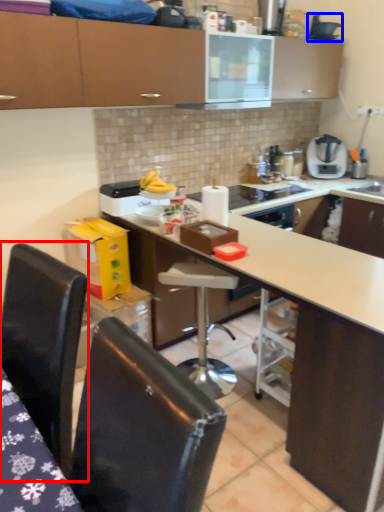
Question: Which point is further to the camera, chair (highlighted by a red box) or appliance (highlighted by a blue box)?

Choices:
 (A) chair
 (B) appliance

Answer: (B)